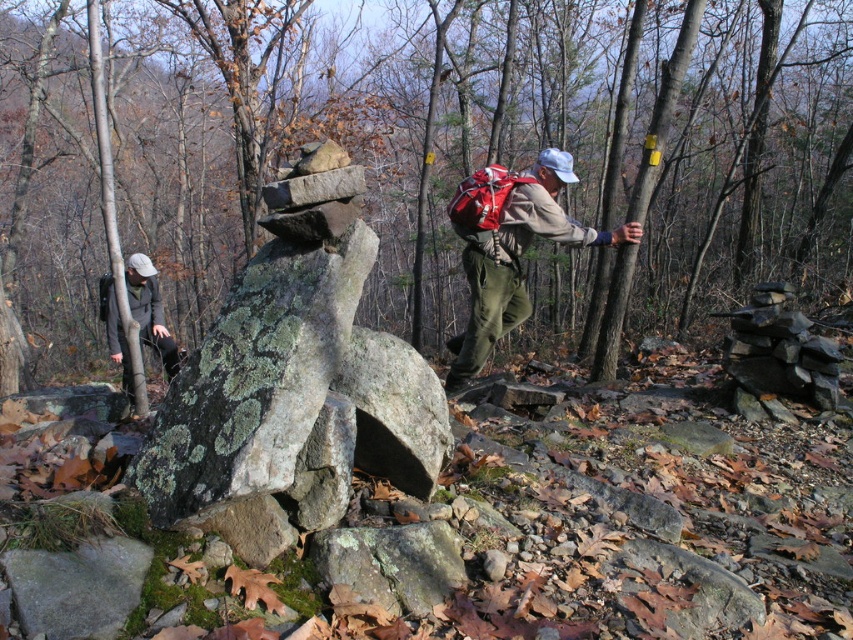
Question: Which of the following is the farthest from the observer?

Choices:
 (A) (119, 349)
 (B) (521, 211)
 (C) (308, 179)

Answer: (A)

Question: Is lichen-covered rock at center smaller than matte red backpack at center?

Choices:
 (A) no
 (B) yes

Answer: (B)

Question: Which object is farther from the camera taking this photo?

Choices:
 (A) khaki fabric jacket at left
 (B) lichen-covered rock at center
 (C) matte red backpack at center

Answer: (C)

Question: Can you confirm if matte red backpack at center is positioned to the right of khaki fabric jacket at left?

Choices:
 (A) no
 (B) yes

Answer: (B)

Question: Among these points, which one is farthest from the camera?

Choices:
 (A) (196, 481)
 (B) (142, 296)

Answer: (B)

Question: From the image, what is the correct spatial relationship of lichen-covered rock at center in relation to matte red backpack at center?

Choices:
 (A) left
 (B) right

Answer: (A)